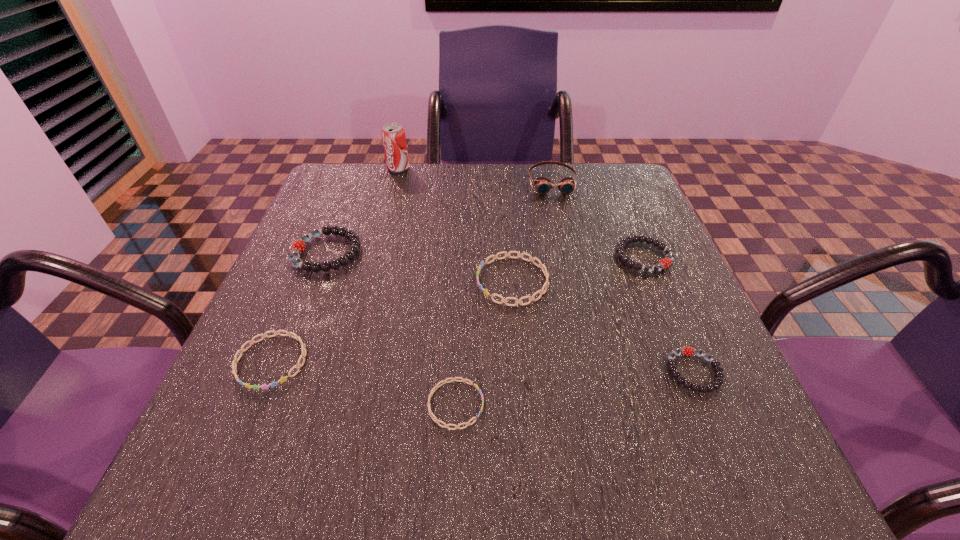
Locate which object ranks fourth in proximity to the shortest object. Please provide its 2D coordinates. Your answer should be formatted as a tuple, i.e. [(x, y)], where the tuple contains the x and y coordinates of a point satisfying the conditions above.

[(298, 246)]

Choose which bracelet is the second nearest neighbor to the sixth object from right to left. Please provide its 2D coordinates. Your answer should be formatted as a tuple, i.e. [(x, y)], where the tuple contains the x and y coordinates of a point satisfying the conditions above.

[(533, 259)]

At what (x,y) coordinates should I click in order to perform the action: click on bracelet object that ranks as the third closest to the seventh shortest object. Please return your answer as a coordinate pair (x, y). Looking at the image, I should click on (298, 246).

This screenshot has height=540, width=960. Identify the location of black bracelet that is the closest to the nearest black bracelet. (664, 263).

Identify which black bracelet is the nearest to the biggest black bracelet. Please provide its 2D coordinates. Your answer should be formatted as a tuple, i.e. [(x, y)], where the tuple contains the x and y coordinates of a point satisfying the conditions above.

[(664, 263)]

The width and height of the screenshot is (960, 540). I want to click on blue bracelet that is the second nearest to the pink soda can, so click(283, 379).

What are the coordinates of `the second closest blue bracelet to the nearest black bracelet` in the screenshot? It's located at (431, 414).

I want to click on vacant space that satisfies the following two spatial constraints: 1. on the surface of the second biggest blue bracelet showing star-shaped elements; 2. on the left side of the nearest black bracelet, so click(x=267, y=372).

The image size is (960, 540). I want to click on vacant space that satisfies the following two spatial constraints: 1. on the back side of the tallest bracelet; 2. on the right side of the soda can, so click(360, 168).

This screenshot has width=960, height=540. I want to click on free region that satisfies the following two spatial constraints: 1. on the front side of the nearest black bracelet; 2. on the left side of the pink soda can, so click(343, 372).